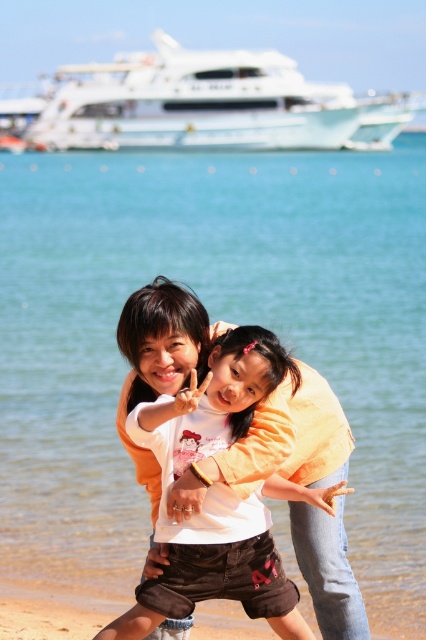
What do you see at coordinates (199, 106) in the screenshot? I see `white glossy boat at upper center` at bounding box center [199, 106].

What do you see at coordinates (199, 106) in the screenshot? I see `white glossy boat at upper center` at bounding box center [199, 106].

You are a GUI agent. You are given a task and a screenshot of the screen. Output one action in this format:
    pyautogui.click(x=<x>, y=<y>)
    Task: Click on the white glossy boat at upper center
    
    Given the screenshot: What is the action you would take?
    pyautogui.click(x=199, y=106)